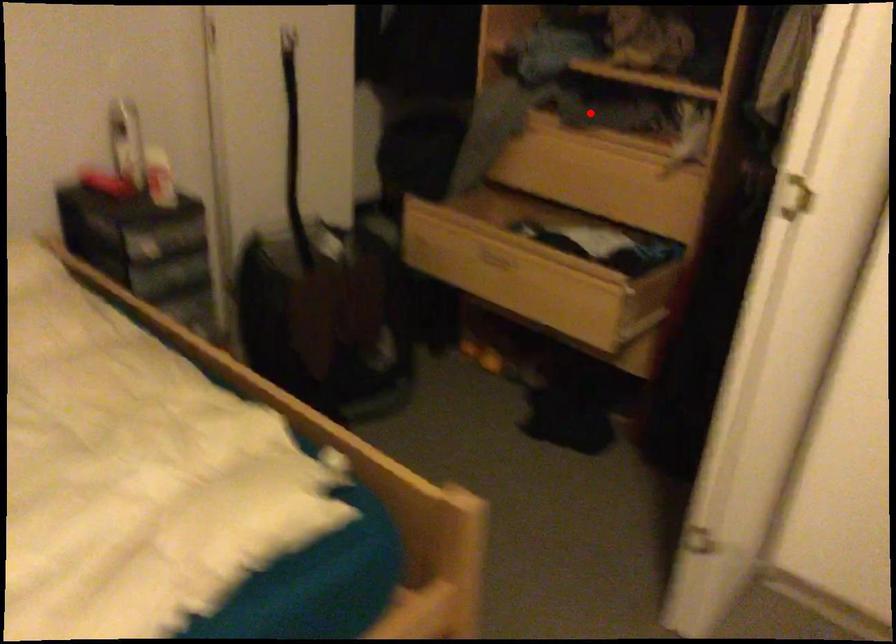
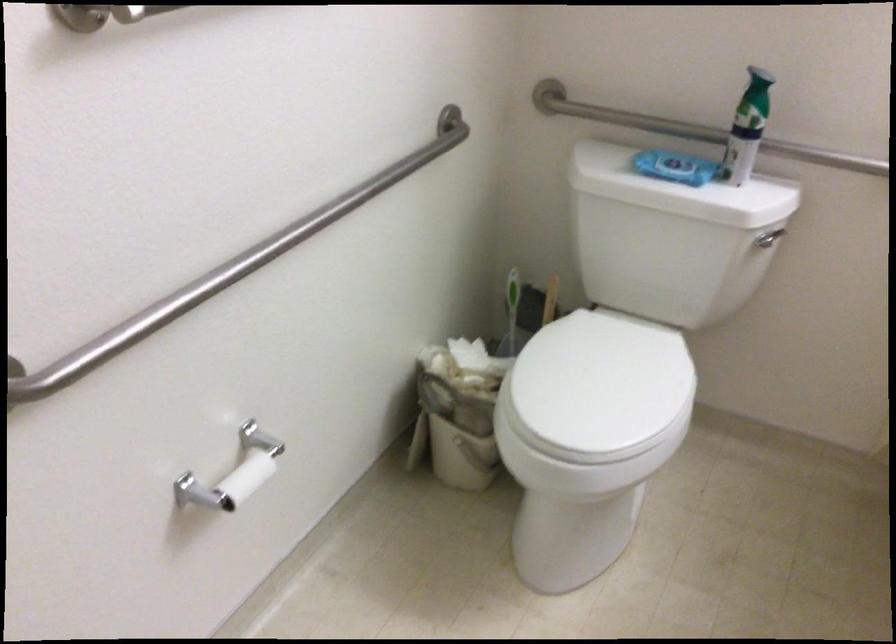
Question: I am providing you with two images of the same scene from different viewpoints. A red point is marked on the first image. Is the red point's position out of view in image 2?

Choices:
 (A) Yes
 (B) No

Answer: (A)